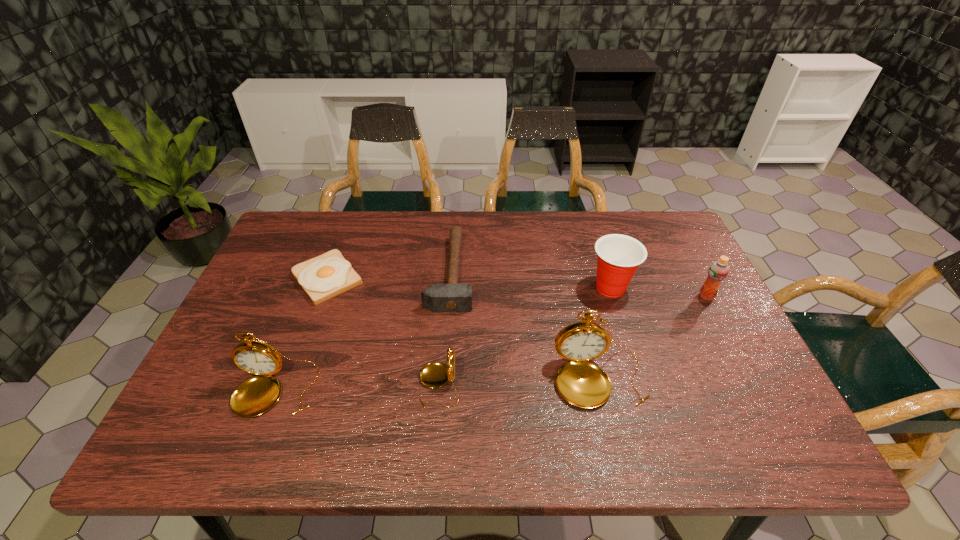
Image resolution: width=960 pixels, height=540 pixels. Find the location of `object that is positioned at the far left corner`. object that is positioned at the far left corner is located at coordinates (328, 275).

This screenshot has width=960, height=540. I want to click on object located at the near left corner, so click(256, 395).

Locate an element on the screen. This screenshot has width=960, height=540. vacant space at the far edge is located at coordinates (394, 239).

In order to click on vacant space at the right edge of the desktop in this screenshot , I will do `click(692, 319)`.

The width and height of the screenshot is (960, 540). Identify the location of vacant position at the far left corner of the desktop. (277, 239).

Where is `free location at the far right corner of the desktop`? Image resolution: width=960 pixels, height=540 pixels. free location at the far right corner of the desktop is located at coordinates (679, 249).

Where is `free space at the near right corner of the desktop`? Image resolution: width=960 pixels, height=540 pixels. free space at the near right corner of the desktop is located at coordinates (735, 394).

At what (x,y) coordinates should I click in order to perform the action: click on vacant area that lies between the second shortest pocket watch and the toast. Please return your answer as a coordinate pair (x, y). This screenshot has width=960, height=540. Looking at the image, I should click on (301, 334).

Locate an element on the screen. This screenshot has width=960, height=540. vacant area between the rightmost pocket watch and the hammer is located at coordinates (524, 326).

The height and width of the screenshot is (540, 960). Identify the location of free space that is in between the second shortest object and the shortest pocket watch. (444, 328).